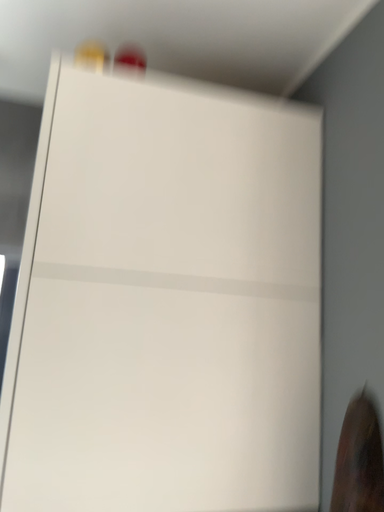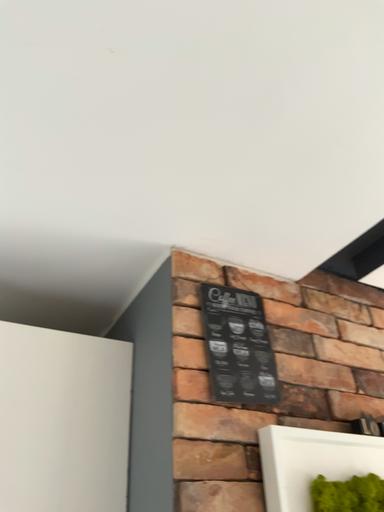
Question: How did the camera likely rotate when shooting the video?

Choices:
 (A) rotated left
 (B) rotated right

Answer: (B)